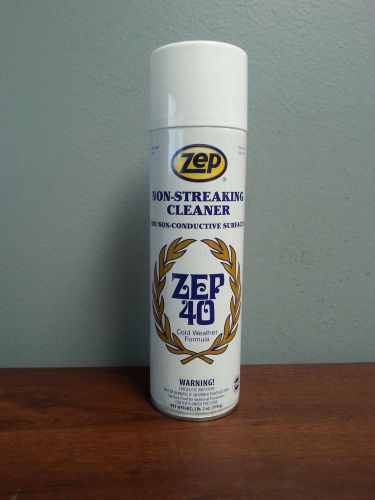
The width and height of the screenshot is (375, 500). In order to click on green wall in this screenshot , I will do `click(297, 288)`, `click(95, 317)`, `click(79, 276)`, `click(251, 246)`, `click(252, 327)`.